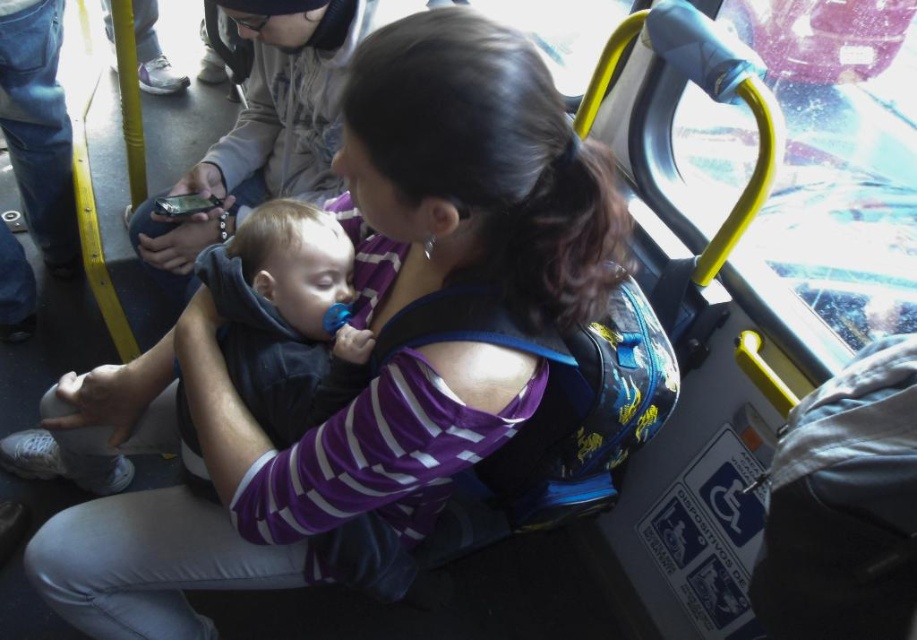
Does dark blue fleece at center have a lesser width compared to matte black phone at upper left?

Correct, dark blue fleece at center's width is less than matte black phone at upper left's.

Can you confirm if dark blue fleece at center is shorter than matte black phone at upper left?

Yes.

Is point (249, 268) less distant than point (204, 220)?

Yes.

The height and width of the screenshot is (640, 917). Identify the location of dark blue fleece at center. (286, 316).

Based on the photo, which of these two, purple striped shirt at center or dark blue fleece at center, stands taller?

Standing taller between the two is purple striped shirt at center.

Does purple striped shirt at center appear on the left side of dark blue fleece at center?

Correct, you'll find purple striped shirt at center to the left of dark blue fleece at center.

In the scene shown: Who is more distant from viewer, (219, 548) or (221, 332)?

The point (219, 548) is more distant.

This screenshot has width=917, height=640. Identify the location of purple striped shirt at center. (372, 352).

Does purple striped shirt at center have a lesser height compared to matte black phone at upper left?

No.

Measure the distance between purple striped shirt at center and camera.

purple striped shirt at center and camera are 25.89 inches apart from each other.

Identify the location of purple striped shirt at center. (372, 352).